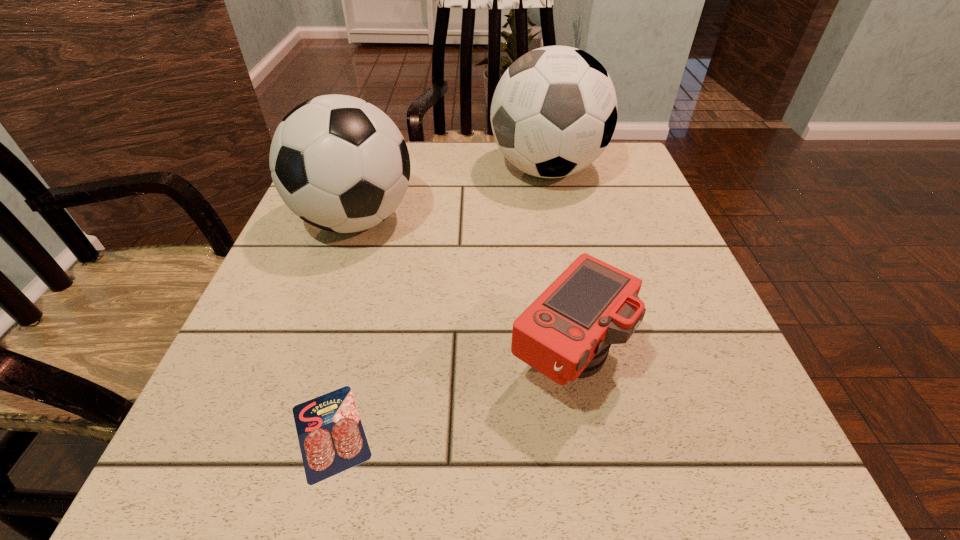
You are a GUI agent. You are given a task and a screenshot of the screen. Output one action in this format:
    pyautogui.click(x=<x>, y=<y>)
    Task: Click on the free region that satisfies the following two spatial constraints: 1. on the main logo of the right soccer ball; 2. on the front side of the left soccer ball
    The image size is (960, 540).
    Given the screenshot: What is the action you would take?
    pyautogui.click(x=557, y=220)